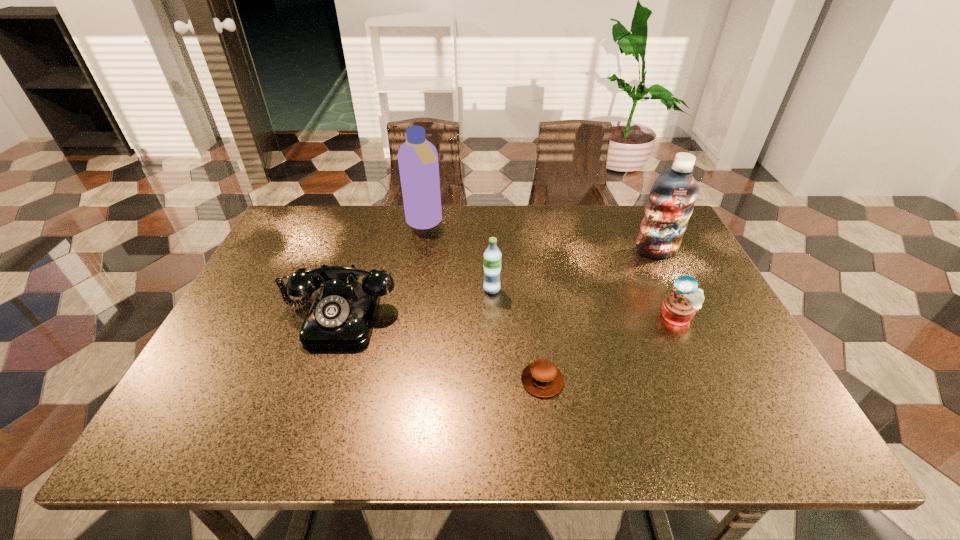
The width and height of the screenshot is (960, 540). In order to click on object at the far right corner in this screenshot , I will do `click(671, 201)`.

Find the location of a particular element. vacant space at the far edge of the desktop is located at coordinates (x=474, y=249).

Identify the location of free region at the near edge of the desktop. (681, 424).

This screenshot has width=960, height=540. Find the location of `vacant space at the left edge of the desktop`. vacant space at the left edge of the desktop is located at coordinates (217, 360).

In the image, there is a desktop. Where is `vacant space at the right edge`? This screenshot has height=540, width=960. vacant space at the right edge is located at coordinates [x=641, y=259].

In the image, there is a desktop. Identify the location of vacant space at the near right corner. This screenshot has height=540, width=960. (739, 422).

Locate an element on the screen. This screenshot has width=960, height=540. unoccupied position between the fourth shortest object and the farthest object is located at coordinates (458, 256).

The height and width of the screenshot is (540, 960). Identify the location of empty space between the farther muffin and the left shampoo. (551, 270).

The width and height of the screenshot is (960, 540). I want to click on empty space that is in between the right shampoo and the taller muffin, so click(x=667, y=284).

This screenshot has width=960, height=540. In order to click on free space between the fourth object from right to left and the farther muffin in this screenshot , I will do `click(585, 303)`.